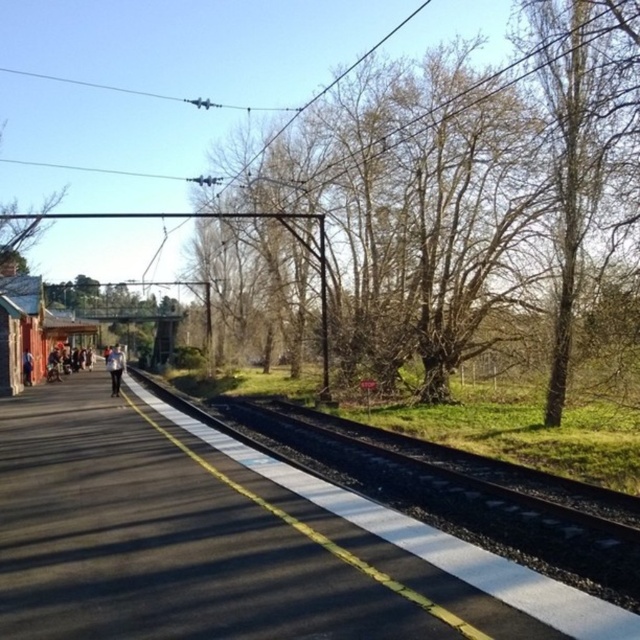
Is black asphalt train track at center shorter than light blue denim pants at left?

Yes.

Is black asphalt train track at center taller than light blue denim pants at left?

In fact, black asphalt train track at center may be shorter than light blue denim pants at left.

Between point (228, 396) and point (26, 376), which one is positioned behind?

Positioned behind is point (228, 396).

What are the coordinates of `black asphalt train track at center` in the screenshot? It's located at (461, 502).

Can you confirm if light blue denim jacket at center is taller than light blue denim pants at left?

Correct, light blue denim jacket at center is much taller as light blue denim pants at left.

Can you confirm if light blue denim jacket at center is wider than light blue denim pants at left?

Yes.

Between point (113, 392) and point (22, 364), which one is positioned in front?

Point (113, 392)

The height and width of the screenshot is (640, 640). What are the coordinates of `light blue denim jacket at center` in the screenshot? It's located at (115, 369).

Does bare branches at center appear under black asphalt train track at center?

Incorrect, bare branches at center is not positioned below black asphalt train track at center.

Is bare branches at center wider than black asphalt train track at center?

Yes.

Looking at this image, who is more distant from viewer, (589,164) or (330,461)?

The point (330,461) is behind.

Where is `bare branches at center`? The image size is (640, 640). bare branches at center is located at coordinates (486, 198).